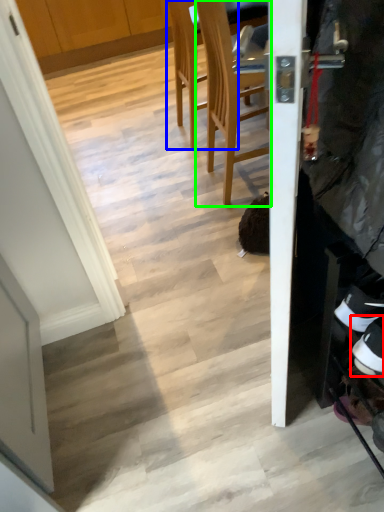
Question: Estimate the real-world distances between objects in this image. Which object is farther from footwear (highlighted by a red box), chair (highlighted by a blue box) or chair (highlighted by a green box)?

Choices:
 (A) chair
 (B) chair

Answer: (A)